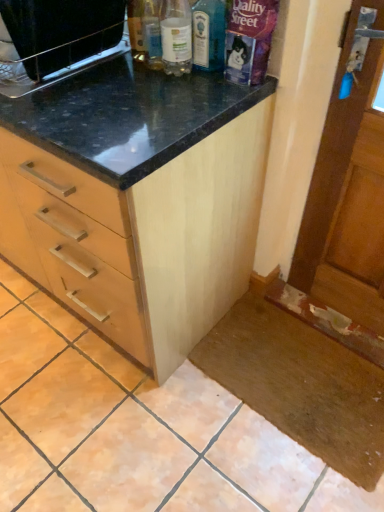
Locate an element on the screen. This screenshot has height=512, width=384. vacant area that lies to the right of clear plastic bottle at upper center, which ranks as the first bottle in left-to-right order is located at coordinates (223, 81).